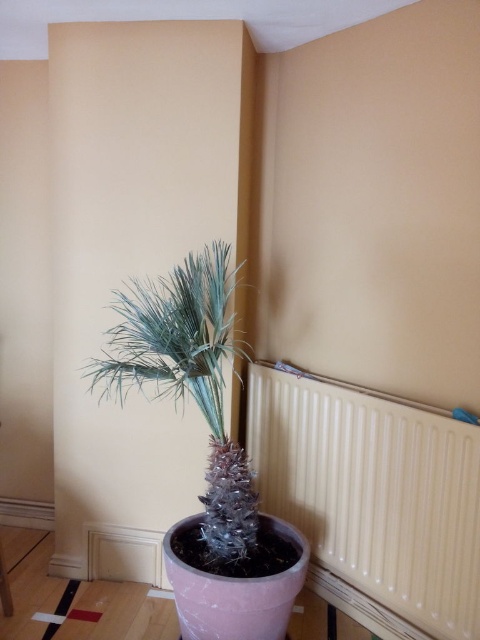
Question: Is white textured radiator at lower right wider than silvery metallic plant at center?

Choices:
 (A) yes
 (B) no

Answer: (A)

Question: Among these objects, which one is farthest from the camera?

Choices:
 (A) white textured radiator at lower right
 (B) silvery metallic plant at center

Answer: (B)

Question: Does white textured radiator at lower right appear on the left side of silvery metallic plant at center?

Choices:
 (A) no
 (B) yes

Answer: (A)

Question: Can you confirm if white textured radiator at lower right is positioned to the right of silvery metallic plant at center?

Choices:
 (A) no
 (B) yes

Answer: (B)

Question: Which object appears farthest from the camera in this image?

Choices:
 (A) white textured radiator at lower right
 (B) silvery metallic plant at center

Answer: (B)

Question: Which of the following is the farthest from the observer?

Choices:
 (A) silvery metallic plant at center
 (B) white textured radiator at lower right

Answer: (A)